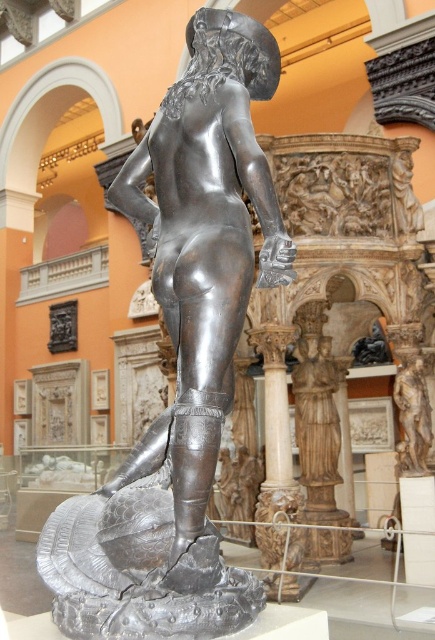
Question: Is the position of polished bronze statue at center less distant than that of polished wood statue at center?

Choices:
 (A) no
 (B) yes

Answer: (B)

Question: In this image, where is polished bronze statue at center located relative to bronze statue at center?

Choices:
 (A) left
 (B) right

Answer: (A)

Question: Does polished wood statue at center have a lesser width compared to bronze statue at center?

Choices:
 (A) no
 (B) yes

Answer: (A)

Question: Which point is closer to the camera?

Choices:
 (A) (196, 360)
 (B) (414, 461)

Answer: (A)

Question: Which object is farther from the camera taking this photo?

Choices:
 (A) polished wood statue at center
 (B) bronze statue at center

Answer: (A)

Question: Which object is positioned closest to the polished bronze statue at center?

Choices:
 (A) bronze statue at center
 (B) polished wood statue at center

Answer: (A)